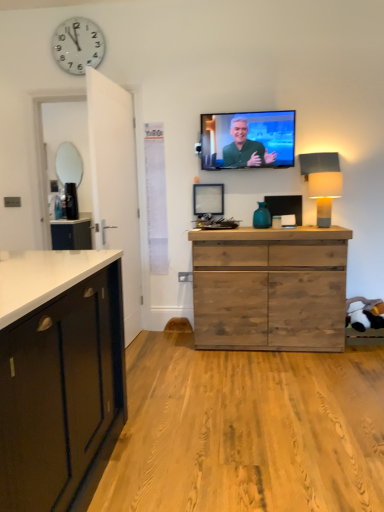
Where is `blue glass vase at center`? blue glass vase at center is located at coordinates (262, 216).

Locate an element on the screen. The image size is (384, 512). white plastic clock at upper left is located at coordinates (78, 45).

The width and height of the screenshot is (384, 512). Describe the element at coordinates (71, 201) in the screenshot. I see `black glossy coffee maker at left` at that location.

This screenshot has width=384, height=512. Describe the element at coordinates (322, 182) in the screenshot. I see `matte gray lampshade at right` at that location.

This screenshot has width=384, height=512. In order to click on matte green screen at upper center in this screenshot , I will do `click(248, 140)`.

The image size is (384, 512). I want to click on rustic wood chest of drawers at center, so click(270, 288).

You are a GUI agent. You are given a task and a screenshot of the screen. Output one action in this format:
    pyautogui.click(x=<x>, y=<y>)
    Task: Click on the blue glass vase at center
    This screenshot has height=512, width=384.
    Given the screenshot: What is the action you would take?
    pyautogui.click(x=262, y=216)

Image resolution: width=384 pixels, height=512 pixels. I want to click on picture frame above the rustic wood chest of drawers at center (from a real-world perspective), so click(x=208, y=199).

Is rustic wood chest of drawers at center located outside wooden picture frame at center?

rustic wood chest of drawers at center lies outside wooden picture frame at center's area.

What's the angular difference between rustic wood chest of drawers at center and wooden picture frame at center's facing directions?

The angle between the facing direction of rustic wood chest of drawers at center and the facing direction of wooden picture frame at center is 0.874 degrees.

From a real-world perspective, does rustic wood chest of drawers at center stand above wooden picture frame at center?

Actually, rustic wood chest of drawers at center is physically below wooden picture frame at center in the real world.

Considering their positions, is white plastic clock at upper left located in front of or behind matte silver mirror at left?

white plastic clock at upper left is positioned closer to the viewer than matte silver mirror at left.

Where is `mirror on the left of white plastic clock at upper left`? This screenshot has height=512, width=384. mirror on the left of white plastic clock at upper left is located at coordinates (69, 164).

Is matte silver mirror at left surrounded by white plastic clock at upper left?

No, matte silver mirror at left is not inside white plastic clock at upper left.

From the image's perspective, is black glossy coffee maker at left beneath matte silver mirror at left?

Yes.

Based on their sizes in the image, would you say black glossy coffee maker at left is bigger or smaller than matte silver mirror at left?

In the image, black glossy coffee maker at left appears to be larger than matte silver mirror at left.

Is black glossy coffee maker at left positioned beyond the bounds of matte silver mirror at left?

Yes, black glossy coffee maker at left is located beyond the bounds of matte silver mirror at left.

Could you tell me if black glossy coffee maker at left is turned towards matte silver mirror at left?

No, black glossy coffee maker at left does not turn towards matte silver mirror at left.

Where is `appliance below the matte green screen at upper center (from a real-world perspective)`? The height and width of the screenshot is (512, 384). appliance below the matte green screen at upper center (from a real-world perspective) is located at coordinates (71, 201).

Would you consider black glossy coffee maker at left to be distant from matte green screen at upper center?

Yes, black glossy coffee maker at left and matte green screen at upper center are located far from each other.

Considering the positions of point (69, 201) and point (214, 145), is point (69, 201) closer or farther from the camera than point (214, 145)?

Clearly, point (69, 201) is more distant from the camera than point (214, 145).

From a real-world perspective, between white plastic clock at upper left and wooden picture frame at center, who is vertically lower?

From a 3D spatial view, wooden picture frame at center is below.

Considering the positions of point (53, 37) and point (214, 189), is point (53, 37) closer or farther from the camera than point (214, 189)?

Point (53, 37) is positioned closer to the camera compared to point (214, 189).

From the image's perspective, is white plastic clock at upper left positioned above or below wooden picture frame at center?

Clearly, from the image's perspective, white plastic clock at upper left is above wooden picture frame at center.

Is white plastic clock at upper left facing away from rustic wood chest of drawers at center?

No, white plastic clock at upper left's orientation is not away from rustic wood chest of drawers at center.

From a real-world perspective, is white plastic clock at upper left on top of rustic wood chest of drawers at center?

Yes, from a real-world perspective, white plastic clock at upper left is over rustic wood chest of drawers at center

Who is taller, white plastic clock at upper left or rustic wood chest of drawers at center?

Standing taller between the two is rustic wood chest of drawers at center.

Considering the relative sizes of wooden picture frame at center and white plastic clock at upper left in the image provided, is wooden picture frame at center bigger than white plastic clock at upper left?

Incorrect, wooden picture frame at center is not larger than white plastic clock at upper left.

Does wooden picture frame at center appear on the left side of white plastic clock at upper left?

No, wooden picture frame at center is not to the left of white plastic clock at upper left.

Locate an element on the screen. The height and width of the screenshot is (512, 384). picture frame that is behind the rustic wood chest of drawers at center is located at coordinates (208, 199).

The height and width of the screenshot is (512, 384). I want to click on mirror located underneath the white plastic clock at upper left (from a real-world perspective), so click(69, 164).

Looking at the image, which one is located further to blue glass vase at center, rustic wood chest of drawers at center or matte green screen at upper center?

Among the two, rustic wood chest of drawers at center is located further to blue glass vase at center.

In the scene shown: Looking at the image, which one is located closer to matte silver mirror at left, rustic wood chest of drawers at center or matte gray lampshade at right?

Among the two, rustic wood chest of drawers at center is located nearer to matte silver mirror at left.

Looking at the image, which one is located closer to blue glass vase at center, white plastic clock at upper left or matte gray lampshade at right?

matte gray lampshade at right lies closer to blue glass vase at center than the other object.

Based on their spatial positions, is matte gray lampshade at right or matte green screen at upper center further from matte silver mirror at left?

matte gray lampshade at right.

Estimate the real-world distances between objects in this image. Which object is closer to rustic wood chest of drawers at center, matte silver mirror at left or wooden picture frame at center?

Based on the image, wooden picture frame at center appears to be nearer to rustic wood chest of drawers at center.

Consider the image. Based on their spatial positions, is white plastic clock at upper left or black glossy coffee maker at left further from matte gray lampshade at right?

Based on the image, white plastic clock at upper left appears to be further to matte gray lampshade at right.

When comparing their distances from black glossy coffee maker at left, does blue glass vase at center or wooden picture frame at center seem closer?

wooden picture frame at center.

Considering their positions, is matte gray lampshade at right positioned closer to rustic wood chest of drawers at center than matte green screen at upper center?

The object closer to rustic wood chest of drawers at center is matte gray lampshade at right.

Identify the location of clock between black glossy coffee maker at left and matte gray lampshade at right. The width and height of the screenshot is (384, 512). (78, 45).

The width and height of the screenshot is (384, 512). What are the coordinates of `television located between black glossy coffee maker at left and rustic wood chest of drawers at center in the left-right direction` in the screenshot? It's located at pos(248,140).

The width and height of the screenshot is (384, 512). In order to click on picture frame between black glossy coffee maker at left and matte gray lampshade at right in the horizontal direction in this screenshot , I will do `click(208, 199)`.

Identify the location of vase between black glossy coffee maker at left and rustic wood chest of drawers at center from left to right. (262, 216).